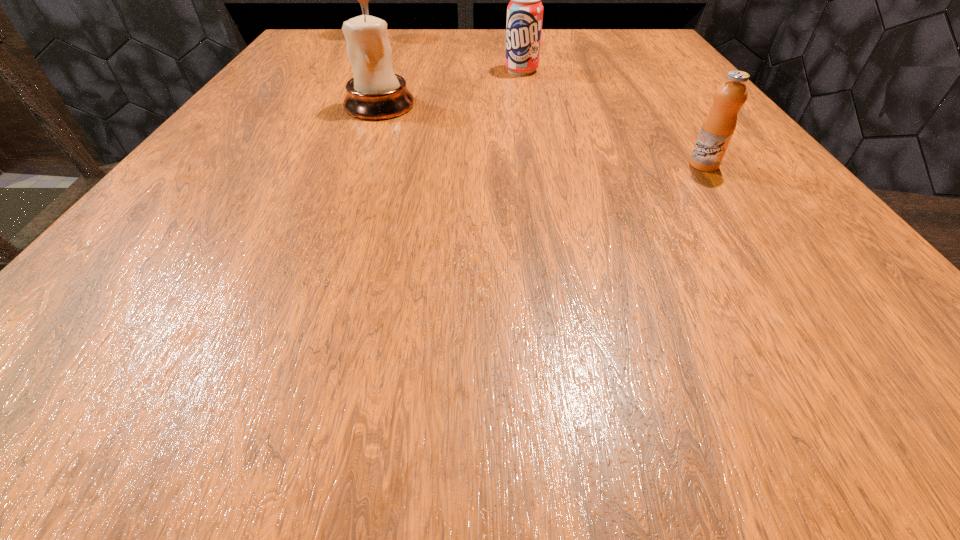
Identify the location of blank area at the far right corner. (621, 63).

Locate an element on the screen. Image resolution: width=960 pixels, height=540 pixels. free space between the wineglass and the third object from left to right is located at coordinates (445, 54).

Where is `vacant area that lies between the farthest object and the orange juice`? vacant area that lies between the farthest object and the orange juice is located at coordinates (537, 101).

Identify the location of free space between the rightmost object and the farthest object. The width and height of the screenshot is (960, 540). (537, 101).

You are a GUI agent. You are given a task and a screenshot of the screen. Output one action in this format:
    pyautogui.click(x=<x>, y=<y>)
    Task: Click on the empty space between the second object from right to left and the orange juice
    
    Given the screenshot: What is the action you would take?
    pyautogui.click(x=612, y=118)

The height and width of the screenshot is (540, 960). In order to click on free spot between the farthest object and the second object from right to left in this screenshot , I will do `click(445, 54)`.

Where is `empty location between the candle holder and the orange juice`? empty location between the candle holder and the orange juice is located at coordinates (541, 135).

The width and height of the screenshot is (960, 540). Identify the location of empty space between the farthest object and the third object from left to right. (445, 54).

In order to click on free spot between the second nearest object and the orange juice in this screenshot , I will do pos(541,135).

Identify which object is located as the second nearest to the second object from right to left. Please provide its 2D coordinates. Your answer should be formatted as a tuple, i.e. [(x, y)], where the tuple contains the x and y coordinates of a point satisfying the conditions above.

[(363, 0)]